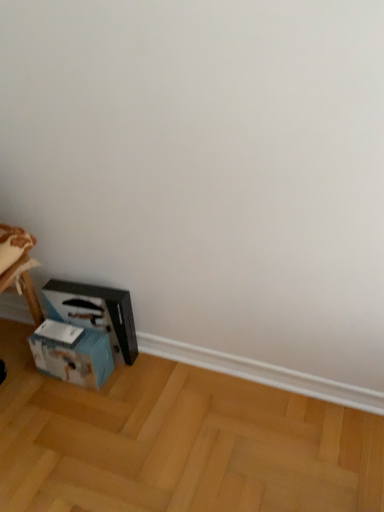
Locate an element on the screen. free location in front of blue cardboard box at lower left is located at coordinates (64, 409).